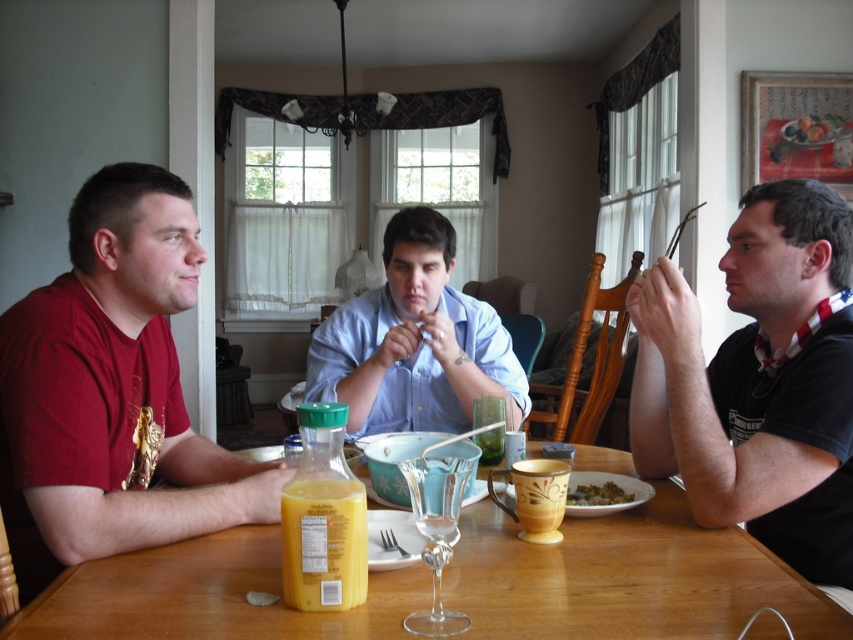
Does light blue shirt at center appear on the left side of translucent glass at table center?

Yes, light blue shirt at center is to the left of translucent glass at table center.

Does light blue shirt at center have a smaller size compared to translucent glass at table center?

No, light blue shirt at center is not smaller than translucent glass at table center.

Find the location of a particular element. light blue shirt at center is located at coordinates (415, 340).

Where is `light blue shirt at center`? light blue shirt at center is located at coordinates (415, 340).

Measure the distance between transparent glass wine glass at center and camera.

transparent glass wine glass at center is 31.52 inches from camera.

Which is above, transparent glass wine glass at center or translucent glass at table center?

transparent glass wine glass at center is above.

Locate an element on the screen. transparent glass wine glass at center is located at coordinates (434, 532).

Which is behind, point (799, 390) or point (585, 500)?

Positioned behind is point (585, 500).

Does black matte shirt at right have a greater height compared to yellow matte bowl at lower center?

Yes, black matte shirt at right is taller than yellow matte bowl at lower center.

This screenshot has width=853, height=640. In order to click on black matte shirt at right in this screenshot , I will do `click(759, 381)`.

This screenshot has width=853, height=640. Identify the location of black matte shirt at right. (759, 381).